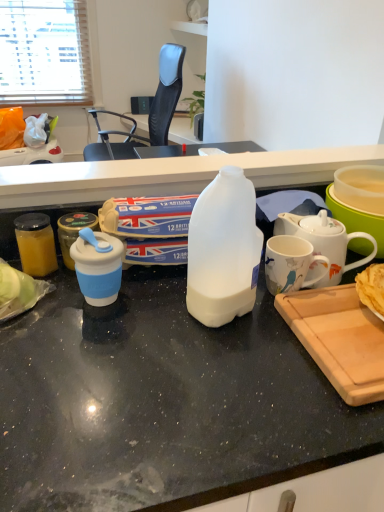
The height and width of the screenshot is (512, 384). Describe the element at coordinates (223, 250) in the screenshot. I see `white matte plastic bottle at center` at that location.

Image resolution: width=384 pixels, height=512 pixels. What do you see at coordinates (324, 243) in the screenshot? I see `white ceramic teapot at right` at bounding box center [324, 243].

This screenshot has width=384, height=512. What do you see at coordinates (357, 220) in the screenshot?
I see `translucent plastic bowl at right` at bounding box center [357, 220].

Locate an element on the screen. Image resolution: width=384 pixels, height=512 pixels. translucent plastic milk bottle at center is located at coordinates (161, 401).

The height and width of the screenshot is (512, 384). I want to click on white matte plastic bottle at center, so click(223, 250).

In the scene shown: Is white ceramic teapot at right aimed at white matte plastic bottle at center?

No, white ceramic teapot at right does not turn towards white matte plastic bottle at center.

Based on the photo, is white ceramic teapot at right in contact with white matte plastic bottle at center?

They are not placed beside each other.

From the image's perspective, is white ceramic teapot at right above or below white matte plastic bottle at center?

white ceramic teapot at right is above white matte plastic bottle at center.

Is point (294, 228) closer or farther from the camera than point (240, 305)?

Point (294, 228).

Could you tell me if translucent glass jar at left, the first kitchen appliance from the left, is facing wooden cutting board at lower right?

No, translucent glass jar at left, the first kitchen appliance from the left, is not facing towards wooden cutting board at lower right.

Is translucent glass jar at left, the first kitchen appliance from the left, outside of wooden cutting board at lower right?

translucent glass jar at left, the first kitchen appliance from the left, lies outside wooden cutting board at lower right's area.

Is translucent glass jar at left, the second kitchen appliance in the right-to-left sequence, positioned far away from wooden cutting board at lower right?

Actually, translucent glass jar at left, the second kitchen appliance in the right-to-left sequence, and wooden cutting board at lower right are a little close together.

From the image's perspective, is translucent glass jar at left, the second kitchen appliance in the right-to-left sequence, beneath wooden cutting board at lower right?

No.

Is blue silicone cup at left, arranged as the second kitchen appliance when viewed from the left, positioned beyond the bounds of wooden cutting board at lower right?

That's correct, blue silicone cup at left, arranged as the second kitchen appliance when viewed from the left, is outside of wooden cutting board at lower right.

Considering the positions of point (63, 237) and point (317, 362), is point (63, 237) closer or farther from the camera than point (317, 362)?

Point (63, 237).

Consider the image. Which of these two, blue silicone cup at left, arranged as the second kitchen appliance when viewed from the left, or wooden cutting board at lower right, is wider?

Wider between the two is wooden cutting board at lower right.

Considering their positions, is blue silicone cup at left, which ranks as the 1th kitchen appliance in right-to-left order, located in front of or behind wooden cutting board at lower right?

blue silicone cup at left, which ranks as the 1th kitchen appliance in right-to-left order, is behind wooden cutting board at lower right.

From the image's perspective, which is below, black mesh chair at upper center or translucent plastic bowl at right?

From the image's view, translucent plastic bowl at right is below.

In the image, there is a translucent plastic bowl at right. Identify the location of chair above it (from the image's perspective). The image size is (384, 512). (149, 112).

Does black mesh chair at upper center appear on the right side of translucent plastic bowl at right?

No.

How much distance is there between black mesh chair at upper center and translucent plastic bowl at right?

The distance of black mesh chair at upper center from translucent plastic bowl at right is 6.28 feet.

Would you say blue silicone cup at left, which ranks as the 1th kitchen appliance in right-to-left order, is outside black mesh chair at upper center?

That's correct, blue silicone cup at left, which ranks as the 1th kitchen appliance in right-to-left order, is outside of black mesh chair at upper center.

From a real-world perspective, is blue silicone cup at left, which ranks as the 1th kitchen appliance in right-to-left order, located higher than black mesh chair at upper center?

Yes.

Between blue silicone cup at left, arranged as the second kitchen appliance when viewed from the left, and black mesh chair at upper center, which one has smaller size?

blue silicone cup at left, arranged as the second kitchen appliance when viewed from the left, is smaller.

Can you confirm if blue silicone cup at left, which ranks as the 1th kitchen appliance in right-to-left order, is positioned to the right of black mesh chair at upper center?

Yes.

At what (x,y) coordinates should I click in order to perform the action: click on desk lying on the left of white ceramic mug at center right, acting as the second coffee cup starting from the left. Please return your answer as a coordinate pair (x, y). The width and height of the screenshot is (384, 512). Looking at the image, I should click on (161, 401).

Is white ceramic mug at center right, the first coffee cup viewed from the right, closer to camera compared to translucent plastic milk bottle at center?

No, white ceramic mug at center right, the first coffee cup viewed from the right, is further to the viewer.

From the image's perspective, which object appears higher, white ceramic mug at center right, acting as the second coffee cup starting from the left, or translucent plastic milk bottle at center?

white ceramic mug at center right, acting as the second coffee cup starting from the left, is shown above in the image.

How many degrees apart are the facing directions of white ceramic mug at center right, acting as the second coffee cup starting from the left, and translucent plastic milk bottle at center?

2.25 degrees.

In the scene shown: From the image's perspective, is translucent glass jar at left, the second kitchen appliance in the right-to-left sequence, located beneath blue silicone cup at left, which ranks as the 1th kitchen appliance in right-to-left order?

Yes, from the image's perspective, translucent glass jar at left, the second kitchen appliance in the right-to-left sequence, is beneath blue silicone cup at left, which ranks as the 1th kitchen appliance in right-to-left order.

How distant is translucent glass jar at left, the second kitchen appliance in the right-to-left sequence, from blue silicone cup at left, which ranks as the 1th kitchen appliance in right-to-left order?

They are 2.07 inches apart.

In the scene shown: From a real-world perspective, which object stands above the other?

From a 3D spatial view, translucent glass jar at left, the first kitchen appliance from the left, is above.

Is translucent glass jar at left, the first kitchen appliance from the left, touching blue silicone cup at left, arranged as the second kitchen appliance when viewed from the left?

Yes, translucent glass jar at left, the first kitchen appliance from the left, is beside blue silicone cup at left, arranged as the second kitchen appliance when viewed from the left.

The width and height of the screenshot is (384, 512). In the image, there is a white matte plastic bottle at center. In order to click on teapot below it (from a real-world perspective) in this screenshot , I will do `click(324, 243)`.

Identify the location of cutting board in front of the translucent glass jar at left, the first kitchen appliance from the left. The image size is (384, 512). (339, 339).

Estimate the real-world distances between objects in this image. Which object is closer to white ceramic mug at center right, acting as the second coffee cup starting from the left, white matte plastic bottle at center or blue silicone cup at left, which ranks as the 1th kitchen appliance in right-to-left order?

white matte plastic bottle at center lies closer to white ceramic mug at center right, acting as the second coffee cup starting from the left, than the other object.

From the image, which object appears to be farther from translucent plastic bowl at right, black mesh chair at upper center or blue silicone cup at left, arranged as the second kitchen appliance when viewed from the left?

Based on the image, black mesh chair at upper center appears to be further to translucent plastic bowl at right.

Considering their positions, is translucent plastic bowl at right positioned further to white matte plastic bottle at center than blue matte coffee cup at left, which ranks as the 1th coffee cup in left-to-right order?

translucent plastic bowl at right is further to white matte plastic bottle at center.

When comparing their distances from translucent plastic bowl at right, does white ceramic teapot at right or blue matte coffee cup at left, the 2th coffee cup from the right, seem further?

blue matte coffee cup at left, the 2th coffee cup from the right, is positioned further to the anchor translucent plastic bowl at right.

Considering their positions, is white ceramic teapot at right positioned further to translucent plastic milk bottle at center than translucent plastic bowl at right?

The object further to translucent plastic milk bottle at center is translucent plastic bowl at right.

From the picture: Estimate the real-world distances between objects in this image. Which object is further from blue matte coffee cup at left, the 2th coffee cup from the right, white matte plastic bottle at center or wooden cutting board at lower right?

wooden cutting board at lower right is further to blue matte coffee cup at left, the 2th coffee cup from the right.

From the image, which object appears to be farther from translucent plastic milk bottle at center, translucent plastic bowl at right or wooden cutting board at lower right?

Based on the image, translucent plastic bowl at right appears to be further to translucent plastic milk bottle at center.

Based on their spatial positions, is white ceramic mug at center right, the first coffee cup viewed from the right, or translucent plastic bowl at right further from blue silicone cup at left, arranged as the second kitchen appliance when viewed from the left?

Based on the image, translucent plastic bowl at right appears to be further to blue silicone cup at left, arranged as the second kitchen appliance when viewed from the left.

Where is `teapot between white matte plastic bottle at center and wooden cutting board at lower right in the horizontal direction`? This screenshot has height=512, width=384. teapot between white matte plastic bottle at center and wooden cutting board at lower right in the horizontal direction is located at coordinates (324, 243).

The image size is (384, 512). I want to click on cutting board between white ceramic teapot at right and translucent plastic milk bottle at center from top to bottom, so pos(339,339).

I want to click on coffee cup situated between blue matte coffee cup at left, the 2th coffee cup from the right, and wooden cutting board at lower right from left to right, so click(x=290, y=264).

The height and width of the screenshot is (512, 384). Identify the location of desk situated between translucent glass jar at left, the first kitchen appliance from the left, and wooden cutting board at lower right from left to right. (161, 401).